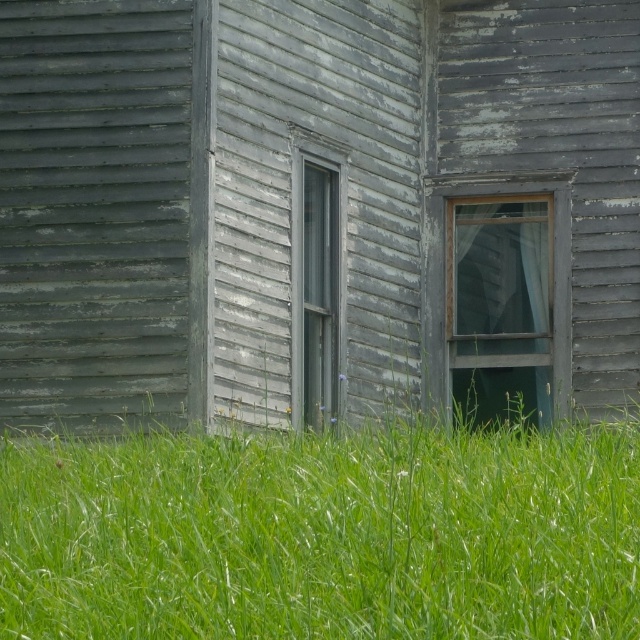
Question: Which point is farther to the camera?

Choices:
 (A) weathered gray wood at center
 (B) transparent glass window at right
 (C) gray wooden window at center

Answer: (A)

Question: Among these points, which one is nearest to the camera?

Choices:
 (A) (561, 301)
 (B) (317, 237)
 (C) (52, 198)

Answer: (C)

Question: Which point appears farthest from the camera in this image?

Choices:
 (A) (196, 332)
 (B) (467, 380)

Answer: (B)

Question: Where is transparent glass window at right located in relation to gray wooden window at center in the image?

Choices:
 (A) right
 (B) left

Answer: (A)

Question: Observing the image, what is the correct spatial positioning of transparent glass window at right in reference to gray wooden window at center?

Choices:
 (A) right
 (B) left

Answer: (A)

Question: Is transparent glass window at right closer to camera compared to gray wooden window at center?

Choices:
 (A) yes
 (B) no

Answer: (B)